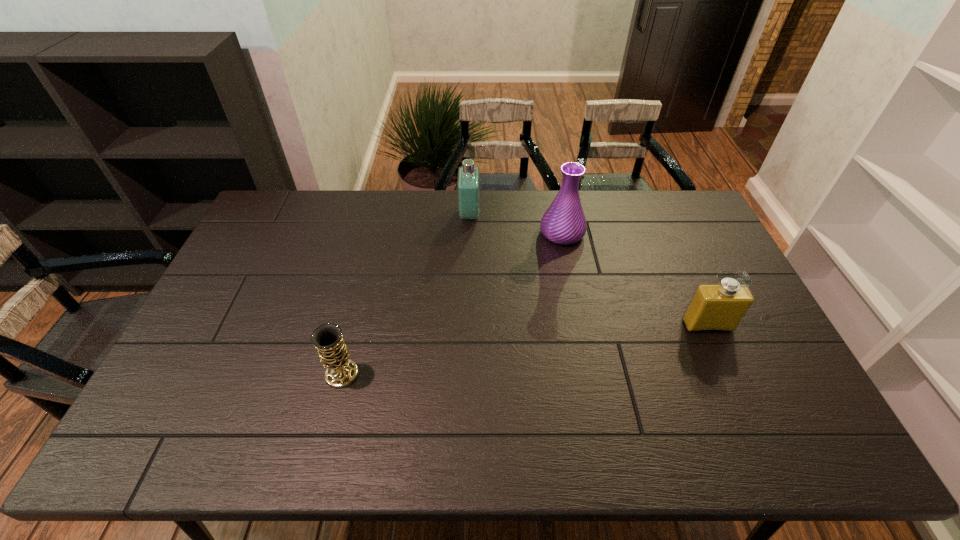
Choose which object is the second nearest neighbor to the farther perfume. Please provide its 2D coordinates. Your answer should be formatted as a tuple, i.e. [(x, y)], where the tuple contains the x and y coordinates of a point satisfying the conditions above.

[(328, 340)]

Locate an element on the screen. vacant space that satisfies the following two spatial constraints: 1. on the front label of the second object from left to right; 2. on the right side of the tallest object is located at coordinates (469, 233).